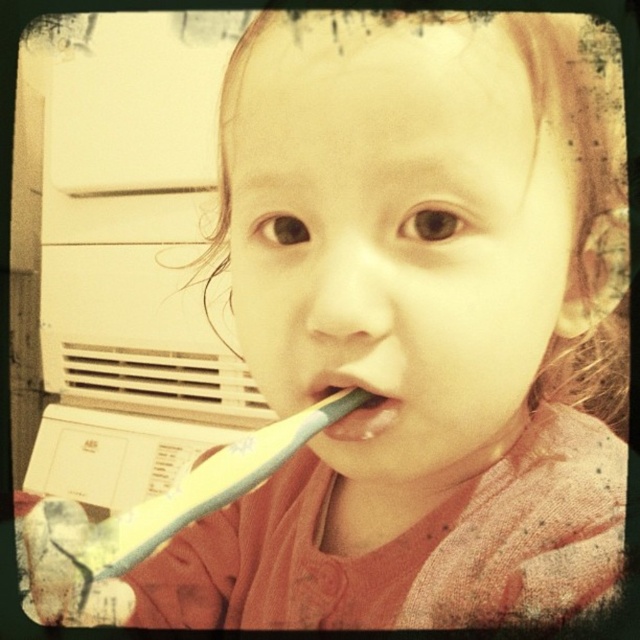
Does yellow-green plastic toothbrush at center appear under white matte toothbrush at center?

Indeed, yellow-green plastic toothbrush at center is positioned under white matte toothbrush at center.

Does yellow-green plastic toothbrush at center appear on the left side of white matte toothbrush at center?

Yes, yellow-green plastic toothbrush at center is to the left of white matte toothbrush at center.

Which is in front, point (170, 513) or point (364, 429)?

Positioned in front is point (170, 513).

Find the location of `yellow-green plastic toothbrush at center`. yellow-green plastic toothbrush at center is located at coordinates (157, 509).